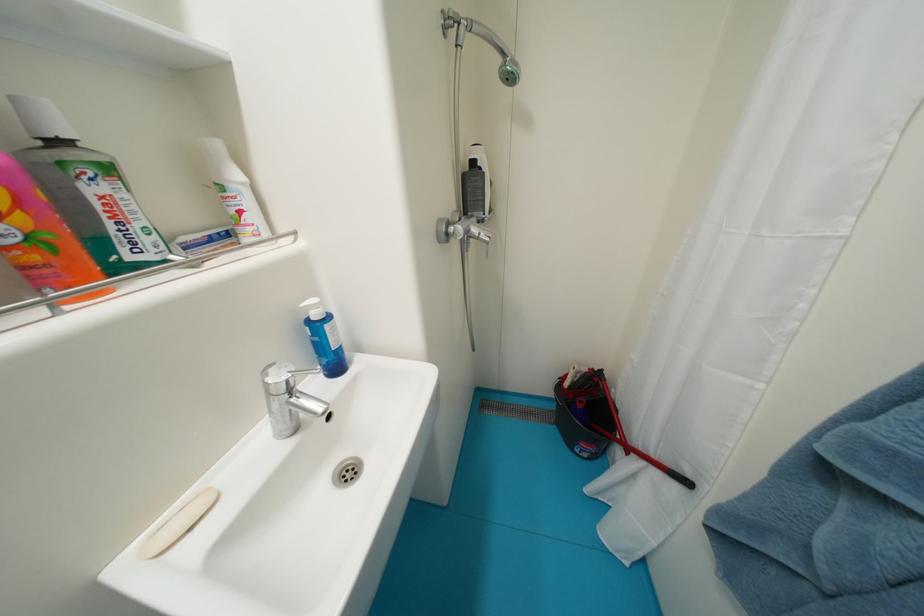
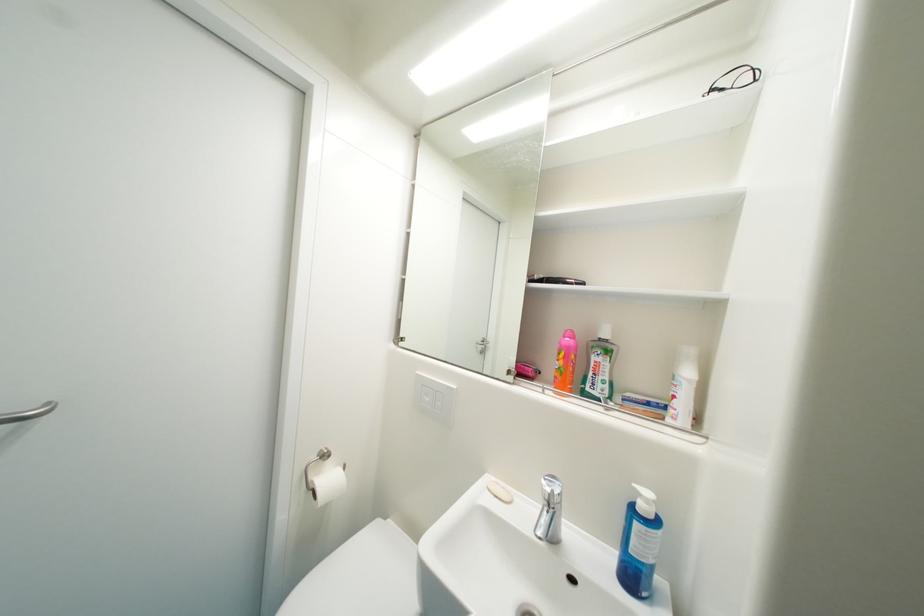
The point at (296, 375) is marked in the first image. Where is the corresponding point in the second image?

(560, 493)